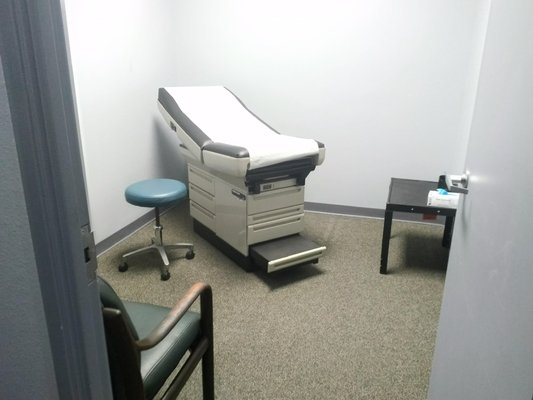
The height and width of the screenshot is (400, 533). I want to click on light reflecting off walls, so click(x=272, y=27), click(x=103, y=31).